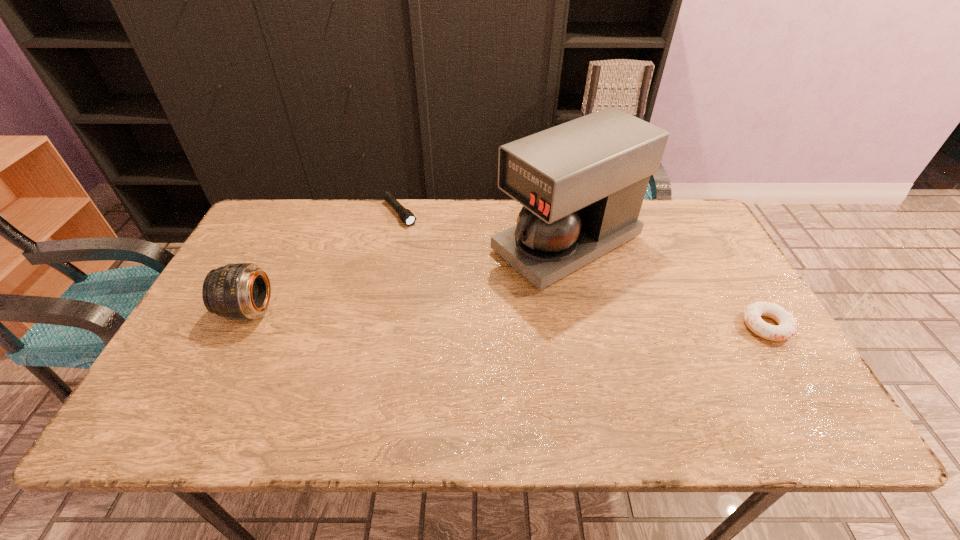
Locate an element on the screen. The height and width of the screenshot is (540, 960). vacant space at the right edge of the desktop is located at coordinates (743, 291).

Find the location of a particular element. This screenshot has width=960, height=540. vacant space at the far right corner of the desktop is located at coordinates (695, 223).

This screenshot has width=960, height=540. Find the location of `free space at the near right corner`. free space at the near right corner is located at coordinates (808, 394).

This screenshot has height=540, width=960. Find the location of `vacant area that lies between the second tallest object and the coffee maker`. vacant area that lies between the second tallest object and the coffee maker is located at coordinates (407, 277).

At what (x,y) coordinates should I click in order to perform the action: click on free space between the third object from left to right and the second tallest object. Please return your answer as a coordinate pair (x, y). This screenshot has width=960, height=540. Looking at the image, I should click on (407, 277).

Identify the location of vacant area that lies between the second tallest object and the flashlight. (324, 262).

The width and height of the screenshot is (960, 540). I want to click on vacant region between the telephoto lens and the third object from left to right, so click(x=407, y=277).

Find the location of a particular element. free spot between the coffee maker and the doughnut is located at coordinates (666, 285).

You are a GUI agent. You are given a task and a screenshot of the screen. Output one action in this format:
    pyautogui.click(x=<x>, y=<y>)
    Task: Click on the free point between the rightmost object and the flashlight
    The height and width of the screenshot is (540, 960).
    Given the screenshot: What is the action you would take?
    pyautogui.click(x=583, y=269)

You are a GUI agent. You are given a task and a screenshot of the screen. Output one action in this format:
    pyautogui.click(x=<x>, y=<y>)
    Task: Click on the vacant area that lies between the third shortest object and the tallest object
    
    Given the screenshot: What is the action you would take?
    pyautogui.click(x=407, y=277)